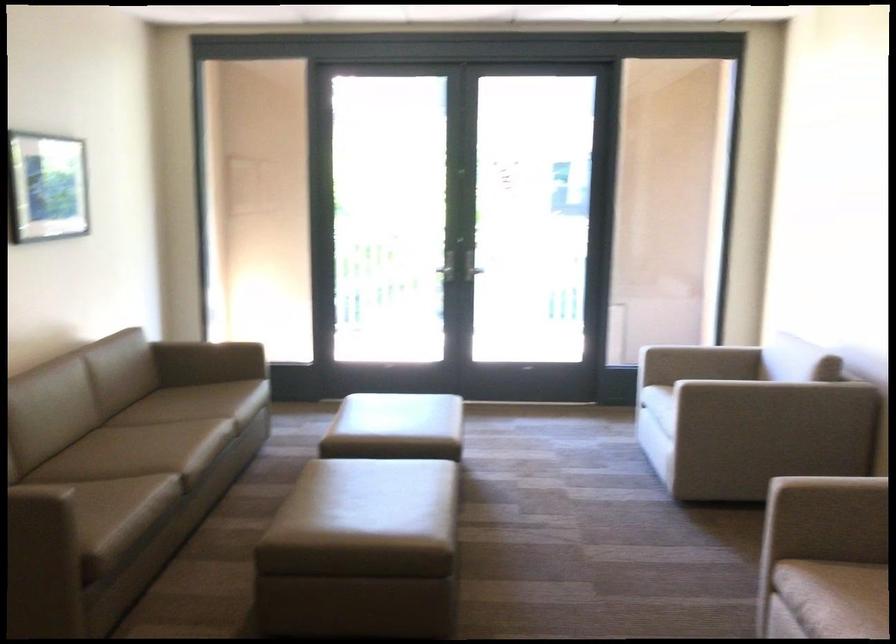
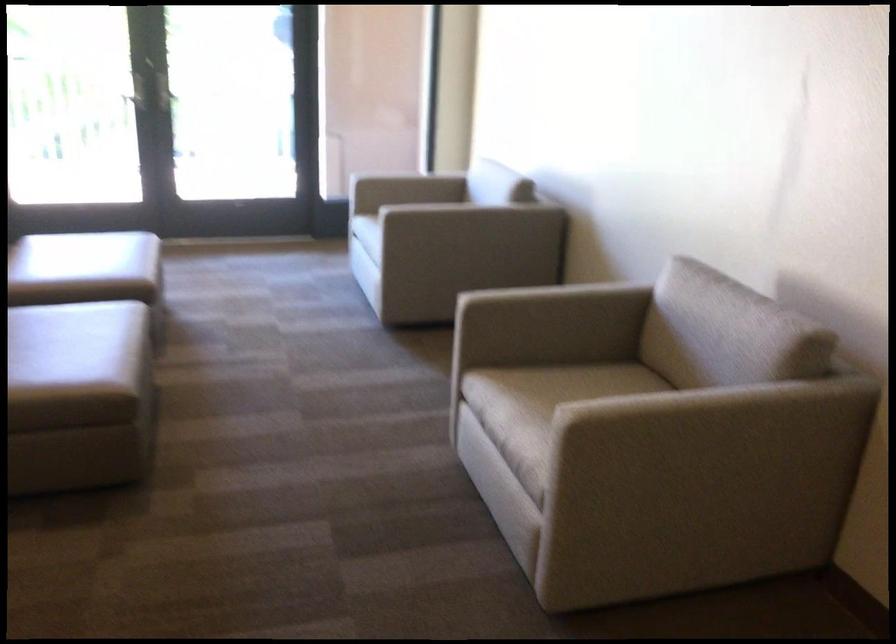
Question: The first image is from the beginning of the video and the second image is from the end. How did the camera likely rotate when shooting the video?

Choices:
 (A) Left
 (B) Right
 (C) Up
 (D) Down

Answer: (B)